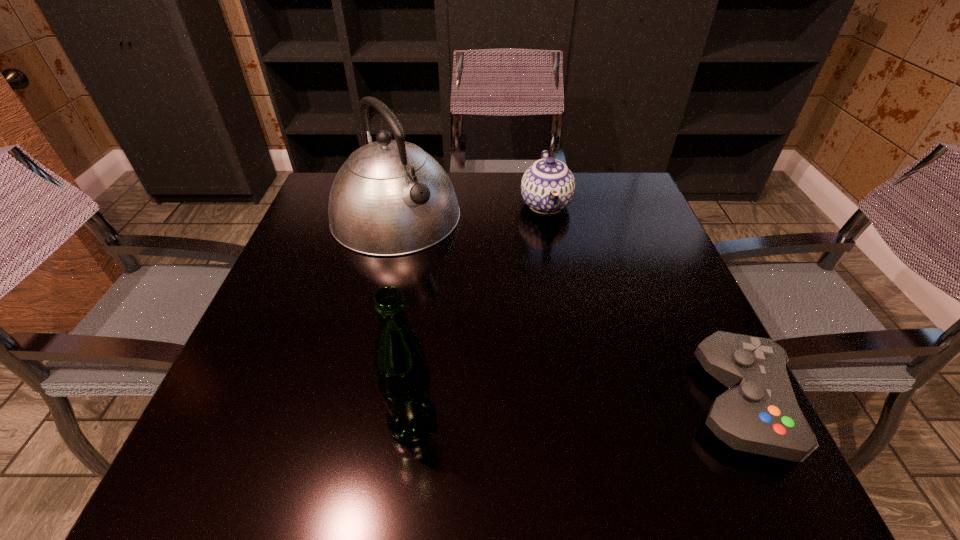
Identify the location of object that is positioned at the far left corner. The width and height of the screenshot is (960, 540). (390, 198).

What are the coordinates of `object that is at the near right corner` in the screenshot? It's located at (x=759, y=413).

This screenshot has width=960, height=540. In the image, there is a desktop. Find the location of `free region at the far edge`. free region at the far edge is located at coordinates (478, 188).

The height and width of the screenshot is (540, 960). In order to click on vacant space at the near edge of the desktop in this screenshot , I will do `click(341, 428)`.

You are a GUI agent. You are given a task and a screenshot of the screen. Output one action in this format:
    pyautogui.click(x=<x>, y=<y>)
    Task: Click on the free spot at the left edge of the desktop
    
    Given the screenshot: What is the action you would take?
    pyautogui.click(x=324, y=360)

Where is `vacant region at the right edge of the desktop`? Image resolution: width=960 pixels, height=540 pixels. vacant region at the right edge of the desktop is located at coordinates (607, 249).

In the image, there is a desktop. Where is `vacant space at the near right corner`? The image size is (960, 540). vacant space at the near right corner is located at coordinates (688, 404).

Locate an element on the screen. unoccupied area between the second shortest object and the control is located at coordinates (643, 304).

The image size is (960, 540). Identify the location of free space between the beer bottle and the chinaware. (479, 313).

The width and height of the screenshot is (960, 540). Identify the location of empty location between the shortest object and the beer bottle. pyautogui.click(x=577, y=413).